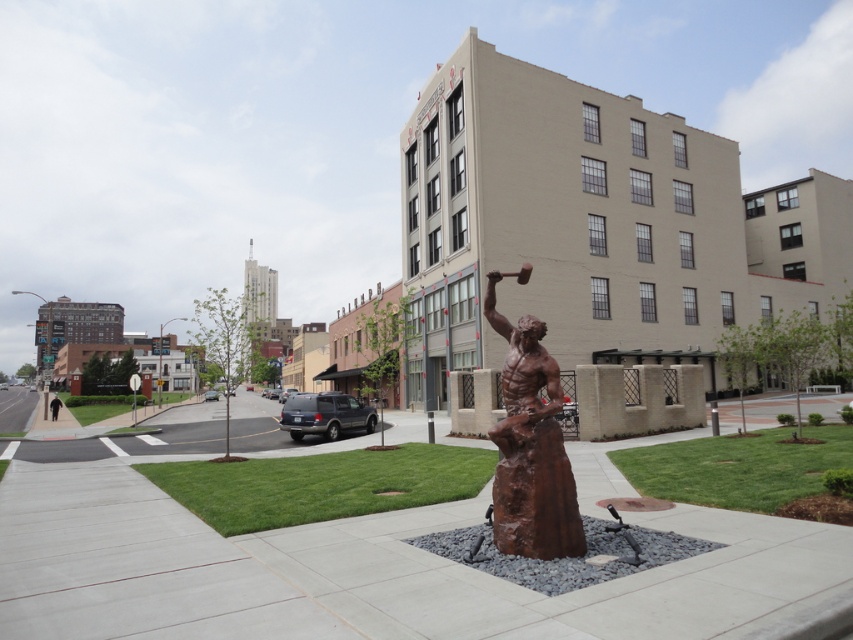
Question: Is smooth concrete pavement at center closer to camera compared to black fabric person at lower left?

Choices:
 (A) no
 (B) yes

Answer: (B)

Question: Which object is farther from the camera taking this photo?

Choices:
 (A) rusty bronze statue at center
 (B) smooth concrete pavement at center
 (C) black fabric person at lower left

Answer: (C)

Question: Does smooth concrete pavement at center appear over rusty bronze statue at center?

Choices:
 (A) no
 (B) yes

Answer: (A)

Question: Which point appears farthest from the camera in this image?

Choices:
 (A) (405, 586)
 (B) (55, 419)
 (C) (561, 449)

Answer: (B)

Question: Among these objects, which one is nearest to the camera?

Choices:
 (A) rusty bronze statue at center
 (B) smooth concrete pavement at center

Answer: (B)

Question: Does rusty bronze statue at center appear on the left side of black fabric person at lower left?

Choices:
 (A) no
 (B) yes

Answer: (A)